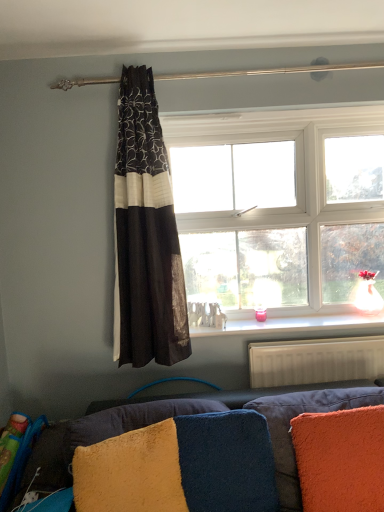
The width and height of the screenshot is (384, 512). Identify the location of blank space above white textured radiator at lower right (from a real-world perspective). (321, 338).